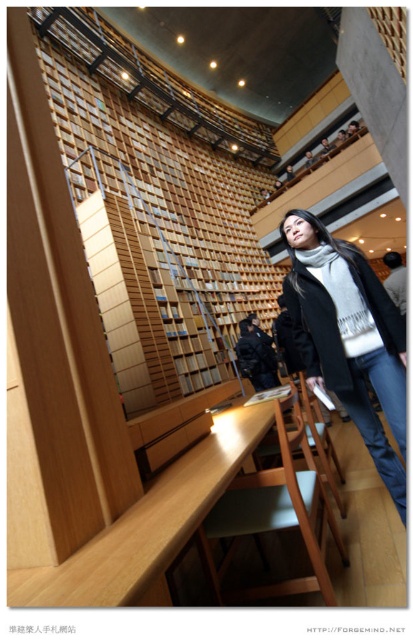
Does light brown wooden chair at lower center appear on the right side of wooden chair at center?

No, light brown wooden chair at lower center is not to the right of wooden chair at center.

Is light brown wooden chair at lower center shorter than wooden chair at center?

Incorrect, light brown wooden chair at lower center's height does not fall short of wooden chair at center's.

Is point (320, 508) farther from camera compared to point (336, 458)?

No, it is not.

I want to click on light brown wooden chair at lower center, so click(x=275, y=513).

Where is `light brown wooden chair at lower center`? This screenshot has height=640, width=413. light brown wooden chair at lower center is located at coordinates point(275,513).

Consider the image. Does light brown wooden chair at lower center appear under dark blue jacket at center?

Correct, light brown wooden chair at lower center is located below dark blue jacket at center.

The height and width of the screenshot is (640, 413). I want to click on light brown wooden chair at lower center, so click(275, 513).

Looking at this image, is light brown wood table at lower center thinner than matte black coat at center?

In fact, light brown wood table at lower center might be wider than matte black coat at center.

Image resolution: width=413 pixels, height=640 pixels. Describe the element at coordinates (197, 516) in the screenshot. I see `light brown wood table at lower center` at that location.

Find the location of a particular element. light brown wood table at lower center is located at coordinates (197, 516).

Image resolution: width=413 pixels, height=640 pixels. I want to click on light brown wood table at lower center, so click(x=197, y=516).